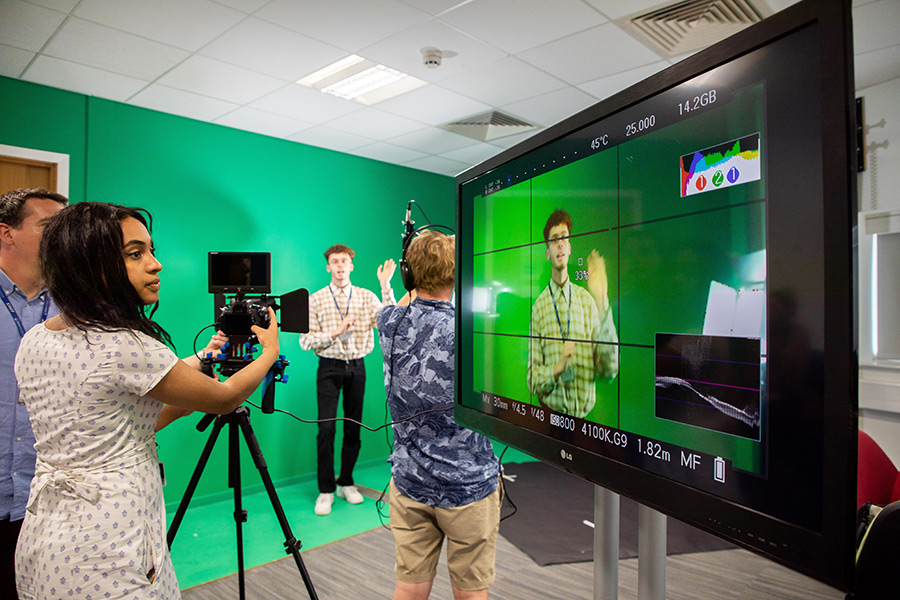
At what (x,y) coordinates should I click in order to perform the action: click on light. Please return your answer as a coordinate pair (x, y). Image resolution: width=900 pixels, height=600 pixels. Looking at the image, I should click on (346, 87).